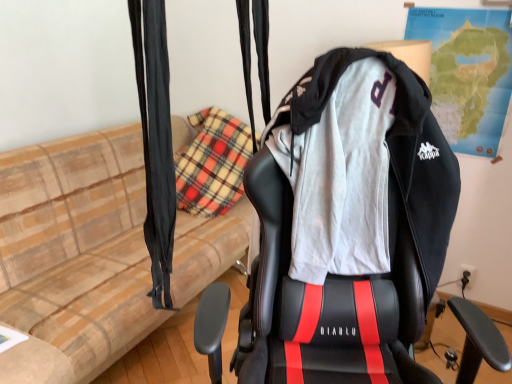
Question: Is black leather gaming chair at center spatially inside black fabric curtain at left, or outside of it?

Choices:
 (A) outside
 (B) inside

Answer: (A)

Question: Looking at their shapes, would you say black leather gaming chair at center is wider or thinner than black fabric curtain at left?

Choices:
 (A) thin
 (B) wide

Answer: (B)

Question: Which of these objects is positioned closest to the black leather gaming chair at center?

Choices:
 (A) black fabric curtain at left
 (B) paper map at upper right
 (C) beige plaid couch at left

Answer: (A)

Question: Based on their relative distances, which object is nearer to the beige plaid couch at left?

Choices:
 (A) black fabric curtain at left
 (B) paper map at upper right
 (C) black leather gaming chair at center

Answer: (C)